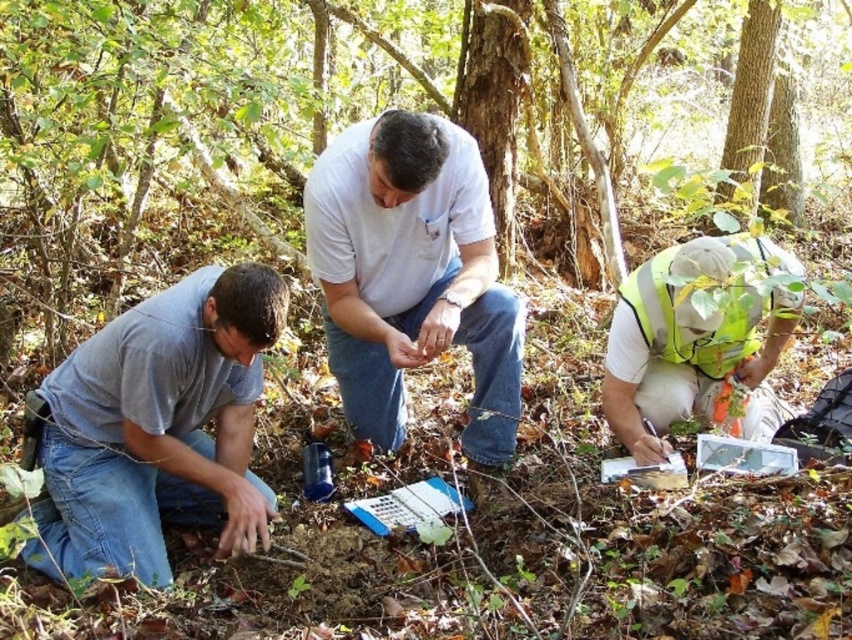
You are a researcher in the field and need to determine the relative positions of two team members based on their clothing. Which team member is taller between the white matte shirt at center and the reflective yellow vest at lower right?

The white matte shirt at center is taller than the reflective yellow vest at lower right according to the description.

You are a researcher in the field and need to determine the relative heights of the two team members based on their clothing. Which person, the one wearing the gray matte shirt at lower left or the reflective yellow vest at lower right, is taller?

The gray matte shirt at lower left is taller than the reflective yellow vest at lower right.